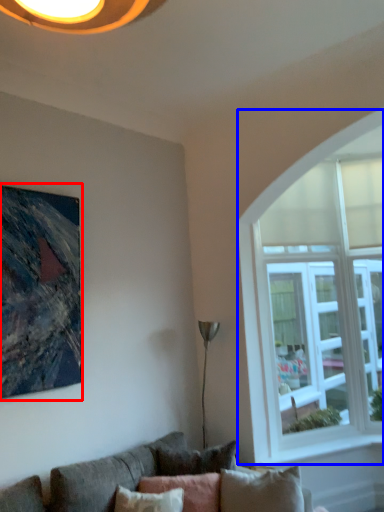
Question: Which object is further to the camera taking this photo, picture frame (highlighted by a red box) or window (highlighted by a blue box)?

Choices:
 (A) picture frame
 (B) window

Answer: (B)